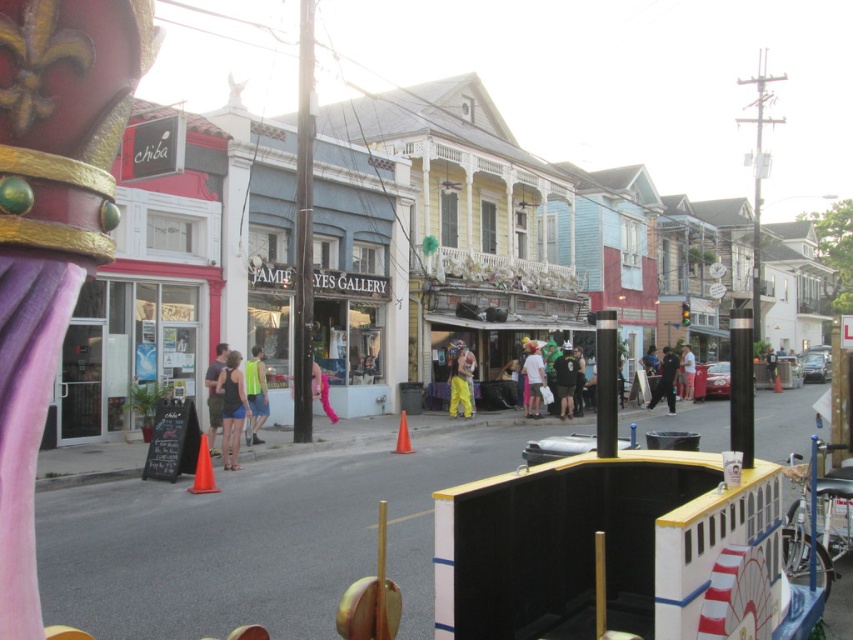
Question: Among these objects, which one is nearest to the camera?

Choices:
 (A) yellow fabric pants at center
 (B) matte black tank top at center
 (C) matte white shirt at center
 (D) black leather jacket at center

Answer: (B)

Question: Which object is closer to the camera taking this photo?

Choices:
 (A) black leather jacket at center
 (B) matte green shorts at center

Answer: (B)

Question: Is yellow fabric pants at center above black leather jacket at center?

Choices:
 (A) no
 (B) yes

Answer: (B)

Question: Does light blue glass storefront at center have a larger size compared to matte green shorts at center?

Choices:
 (A) no
 (B) yes

Answer: (B)

Question: Can you confirm if matte green shorts at center is positioned below pink fabric pants at center?

Choices:
 (A) yes
 (B) no

Answer: (A)

Question: Which is farther from the black fabric pants at center?

Choices:
 (A) matte white shirt at center
 (B) yellow fabric pants at center
 (C) matte black tank top at center

Answer: (C)